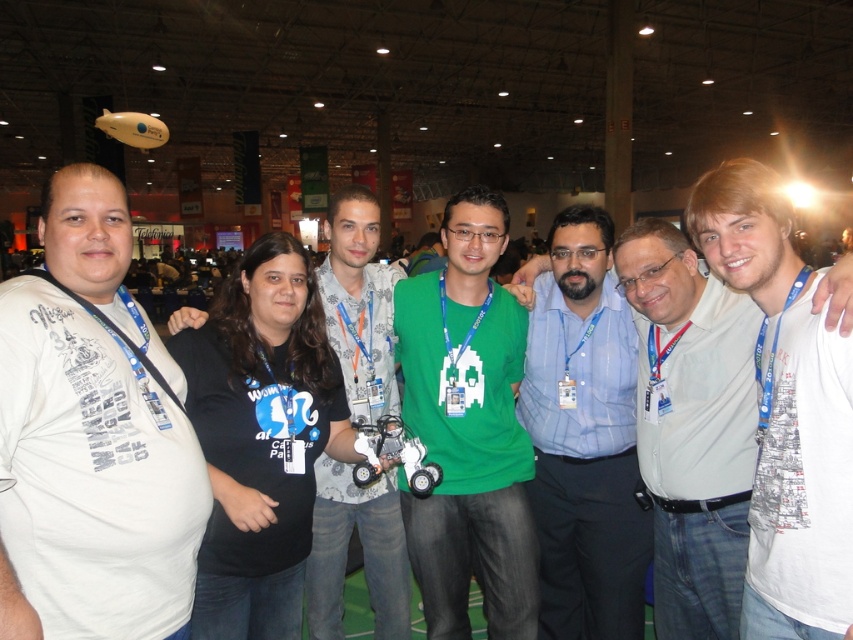
Question: Can you confirm if black cotton t-shirt at center is positioned to the right of blue shirt at center?

Choices:
 (A) no
 (B) yes

Answer: (A)

Question: Based on their relative distances, which object is farther from the patterned fabric shirt at center?

Choices:
 (A) blue shirt at center
 (B) white printed tank top at right
 (C) black cotton t-shirt at center
 (D) light blue button-down shirt at center

Answer: (B)

Question: Which object is positioned closest to the green matte shirt at center?

Choices:
 (A) patterned fabric shirt at center
 (B) white cotton shirt at left
 (C) light blue button-down shirt at center

Answer: (A)

Question: Is black cotton t-shirt at center to the left of white printed tank top at right from the viewer's perspective?

Choices:
 (A) yes
 (B) no

Answer: (A)

Question: Can you confirm if white cotton shirt at left is smaller than green matte shirt at center?

Choices:
 (A) yes
 (B) no

Answer: (A)

Question: Which point appears farthest from the camera in this image?

Choices:
 (A) (764, 268)
 (B) (410, 486)

Answer: (B)